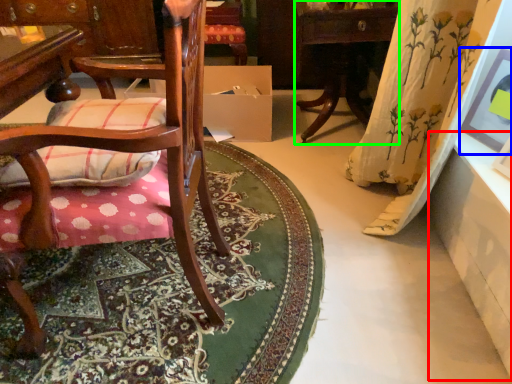
Question: Considering the real-world distances, which object is closest to table (highlighted by a red box)? picture frame (highlighted by a blue box) or table (highlighted by a green box).

Choices:
 (A) picture frame
 (B) table

Answer: (A)